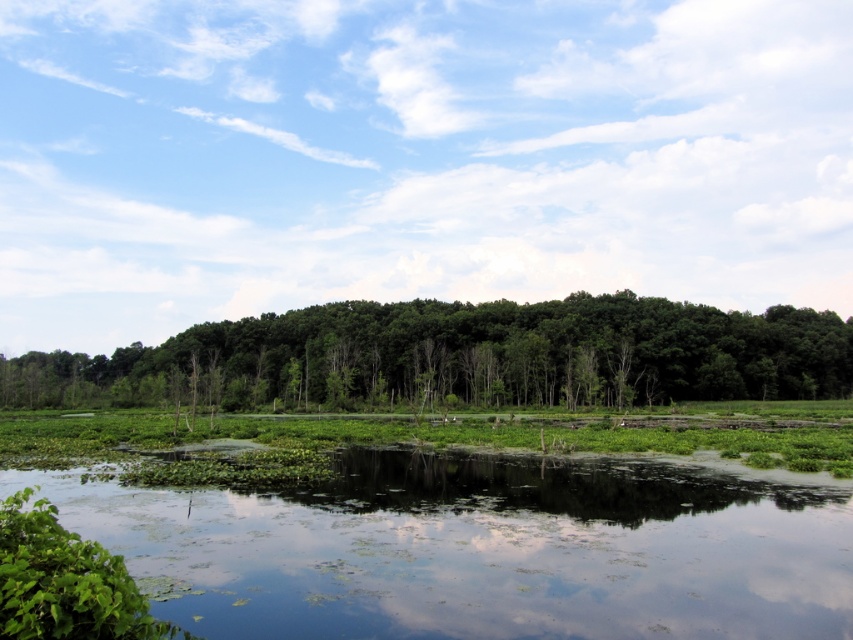
How much distance is there between green leafy water at bottom and green leafy trees at center?

354.12 feet

Does green leafy water at bottom appear under green leafy trees at center?

Yes, green leafy water at bottom is below green leafy trees at center.

Who is more forward, (384, 460) or (612, 349)?

Point (384, 460) is more forward.

This screenshot has width=853, height=640. Identify the location of green leafy water at bottom. (483, 548).